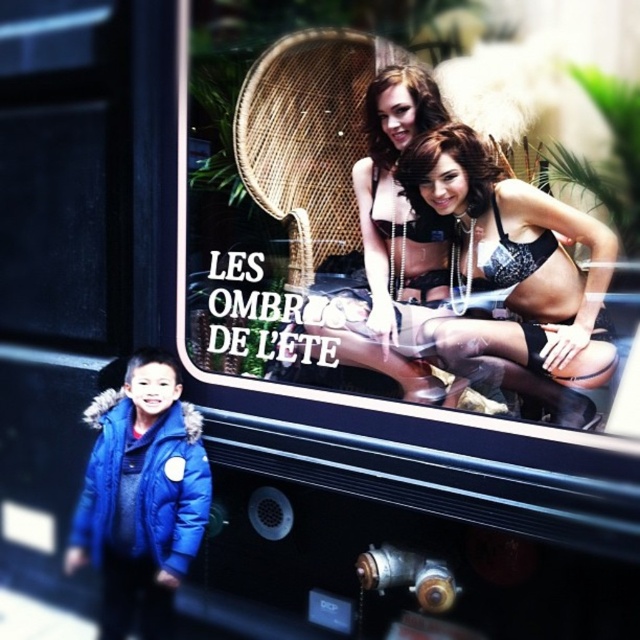
Can you confirm if blue down jacket at left is taller than shiny brown hair at center?

Yes, blue down jacket at left is taller than shiny brown hair at center.

Is blue down jacket at left thinner than shiny brown hair at center?

No.

You are a GUI agent. You are given a task and a screenshot of the screen. Output one action in this format:
    pyautogui.click(x=<x>, y=<y>)
    Task: Click on the blue down jacket at left
    
    Given the screenshot: What is the action you would take?
    pyautogui.click(x=141, y=497)

You are a GUI agent. You are given a task and a screenshot of the screen. Output one action in this format:
    pyautogui.click(x=<x>, y=<y>)
    Task: Click on the blue down jacket at left
    
    Given the screenshot: What is the action you would take?
    pyautogui.click(x=141, y=497)

Describe the element at coordinates (451, 157) in the screenshot. I see `shiny brown hair at center` at that location.

Can you confirm if shiny brown hair at center is positioned to the right of shiny brown hair at upper center?

Yes, shiny brown hair at center is to the right of shiny brown hair at upper center.

Is point (410, 156) closer to viewer compared to point (381, 168)?

Yes.

At what (x,y) coordinates should I click in order to perform the action: click on shiny brown hair at center. Please return your answer as a coordinate pair (x, y). The height and width of the screenshot is (640, 640). Looking at the image, I should click on 451,157.

Can you confirm if metallic gold chair at upper center is taller than blue down jacket at left?

Yes, metallic gold chair at upper center is taller than blue down jacket at left.

Describe the element at coordinates (355, 273) in the screenshot. Image resolution: width=640 pixels, height=640 pixels. I see `metallic gold chair at upper center` at that location.

Which is in front, point (212, 314) or point (140, 419)?

Point (140, 419) is more forward.

Find the location of a particular element. The width and height of the screenshot is (640, 640). metallic gold chair at upper center is located at coordinates (355, 273).